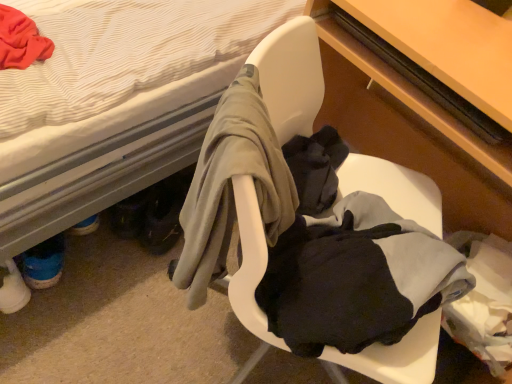
Question: Considering the relative sizes of wooden table at right and white fabric bed at upper left in the image provided, is wooden table at right smaller than white fabric bed at upper left?

Choices:
 (A) yes
 (B) no

Answer: (A)

Question: Does wooden table at right have a lesser height compared to white fabric bed at upper left?

Choices:
 (A) yes
 (B) no

Answer: (A)

Question: Is wooden table at right positioned before white fabric bed at upper left?

Choices:
 (A) yes
 (B) no

Answer: (B)

Question: From the image's perspective, does wooden table at right appear lower than white fabric bed at upper left?

Choices:
 (A) no
 (B) yes

Answer: (B)

Question: Could you tell me if wooden table at right is facing white fabric bed at upper left?

Choices:
 (A) yes
 (B) no

Answer: (B)

Question: Is wooden table at right taller than white fabric bed at upper left?

Choices:
 (A) no
 (B) yes

Answer: (A)

Question: Does white plastic chair at center have a lesser width compared to wooden table at right?

Choices:
 (A) yes
 (B) no

Answer: (B)

Question: From a real-world perspective, is white plastic chair at center under wooden table at right?

Choices:
 (A) yes
 (B) no

Answer: (A)

Question: From the image's perspective, is white plastic chair at center on top of wooden table at right?

Choices:
 (A) no
 (B) yes

Answer: (A)

Question: Is white plastic chair at center to the right of wooden table at right from the viewer's perspective?

Choices:
 (A) yes
 (B) no

Answer: (B)

Question: Is white plastic chair at center positioned beyond the bounds of wooden table at right?

Choices:
 (A) no
 (B) yes

Answer: (B)

Question: Is white plastic chair at center at the left side of wooden table at right?

Choices:
 (A) yes
 (B) no

Answer: (A)

Question: Can matte wood desk at center be found inside wooden table at right?

Choices:
 (A) no
 (B) yes

Answer: (A)